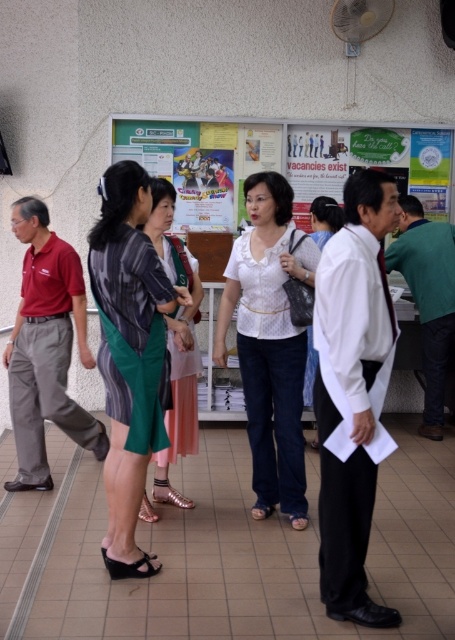
Who is more distant from viewer, (145, 266) or (276, 257)?

Point (276, 257)

Between striped fabric dress at center and white lace blouse at center, which one appears on the left side from the viewer's perspective?

Positioned to the left is striped fabric dress at center.

Find the location of a particular element. The width and height of the screenshot is (455, 640). striped fabric dress at center is located at coordinates (130, 355).

Can you confirm if white lace blouse at center is positioned to the left of white textured blouse at center?

Correct, you'll find white lace blouse at center to the left of white textured blouse at center.

Does white lace blouse at center lie in front of white textured blouse at center?

Yes, it is in front of white textured blouse at center.

Does point (268, 474) come behind point (322, 198)?

No.

Where is `white lace blouse at center`? Image resolution: width=455 pixels, height=640 pixels. white lace blouse at center is located at coordinates (269, 342).

Who is higher up, striped fabric dress at center or white textured blouse at center?

white textured blouse at center is higher up.

Who is taller, striped fabric dress at center or white textured blouse at center?

striped fabric dress at center is taller.

The height and width of the screenshot is (640, 455). What do you see at coordinates (130, 355) in the screenshot?
I see `striped fabric dress at center` at bounding box center [130, 355].

Where is `striped fabric dress at center`? striped fabric dress at center is located at coordinates (130, 355).